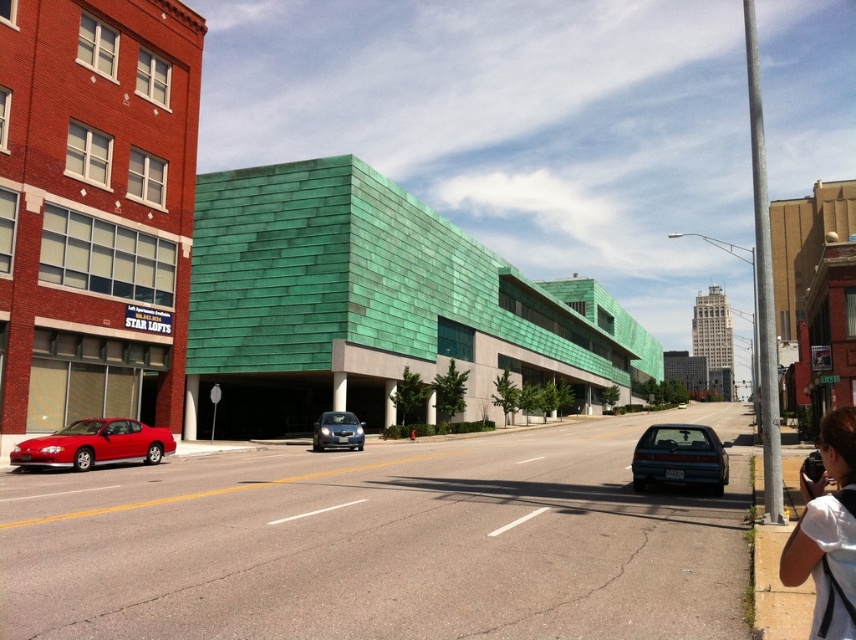
You are standing at the point with coordinates point (31, 445) and want to take a photo of the scene. There is an obstruction at point (663, 440) blocking your view. Can you move forward to get a clearer shot?

Point (31, 445) is behind point (663, 440), so moving forward might not help as the obstruction is in front of you.

Consider the image. You are a pedestrian standing on the sidewalk in the urban street scene. You notice a white fabric at lower right and a matte red car at lower left. Which object is larger in size?

The matte red car at lower left is larger than the white fabric at lower right.

You are a pedestrian standing on the sidewalk and want to cross the road to reach the satin blue sedan at center. Is the matte red car at lower left blocking your path?

The matte red car at lower left is in front of the satin blue sedan at center, so it is blocking the path to the satin blue sedan at center.